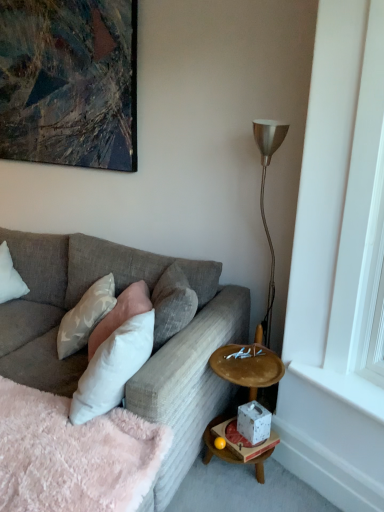
Question: Does point (61, 72) appear closer or farther from the camera than point (258, 425)?

Choices:
 (A) farther
 (B) closer

Answer: (A)

Question: In terms of height, does metallic abstract painting at upper left look taller or shorter compared to white speckled ceramic at lower right?

Choices:
 (A) short
 (B) tall

Answer: (B)

Question: Which is nearer to the white paper tissue box at lower right?

Choices:
 (A) fluffy pink blanket at lower left
 (B) metallic abstract painting at upper left
 (C) white speckled ceramic at lower right
 (D) textured gray couch at center
 (E) white soft pillow at center, the second pillow viewed from the left

Answer: (C)

Question: Which object is positioned farthest from the fluffy pink blanket at lower left?

Choices:
 (A) metallic abstract painting at upper left
 (B) textured gray couch at center
 (C) white smooth window sill at lower right
 (D) white speckled ceramic at lower right
 (E) white soft pillow at center, the second pillow viewed from the left

Answer: (A)